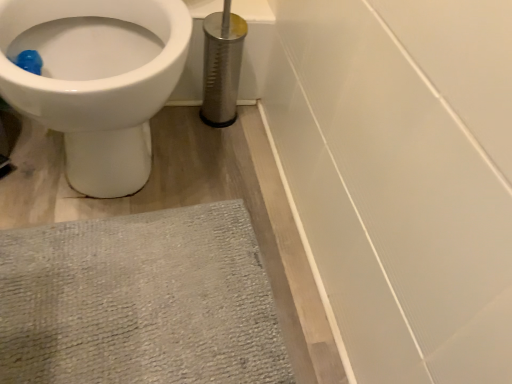
Locate an element on the screen. The width and height of the screenshot is (512, 384). vacant space behind gray textured bath mat at lower left is located at coordinates (201, 174).